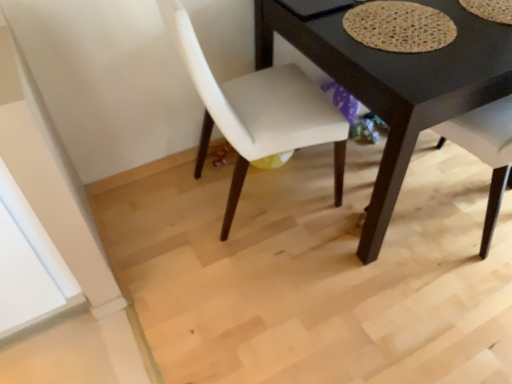
Question: Is white fabric chair at center shorter than textured beige mat at upper right?

Choices:
 (A) no
 (B) yes

Answer: (A)

Question: Considering the relative sizes of white fabric chair at center and textured beige mat at upper right in the image provided, is white fabric chair at center taller than textured beige mat at upper right?

Choices:
 (A) yes
 (B) no

Answer: (A)

Question: Can you confirm if white fabric chair at center is positioned to the left of textured beige mat at upper right?

Choices:
 (A) no
 (B) yes

Answer: (B)

Question: Is white fabric chair at center positioned in front of textured beige mat at upper right?

Choices:
 (A) yes
 (B) no

Answer: (A)

Question: Does white fabric chair at center have a lesser width compared to textured beige mat at upper right?

Choices:
 (A) yes
 (B) no

Answer: (B)

Question: Is point (419, 24) closer or farther from the camera than point (399, 97)?

Choices:
 (A) closer
 (B) farther

Answer: (B)

Question: Visually, is textured beige mat at upper right positioned to the left or to the right of black matte table at center?

Choices:
 (A) right
 (B) left

Answer: (B)

Question: In terms of width, does textured beige mat at upper right look wider or thinner when compared to black matte table at center?

Choices:
 (A) wide
 (B) thin

Answer: (B)

Question: From the image's perspective, relative to black matte table at center, is textured beige mat at upper right above or below?

Choices:
 (A) above
 (B) below

Answer: (A)

Question: Based on their positions, is textured beige mat at upper right located to the left or right of white fabric chair at center?

Choices:
 (A) left
 (B) right

Answer: (B)

Question: From a real-world perspective, is textured beige mat at upper right physically located above or below white fabric chair at center?

Choices:
 (A) above
 (B) below

Answer: (A)

Question: Is textured beige mat at upper right bigger or smaller than white fabric chair at center?

Choices:
 (A) small
 (B) big

Answer: (A)

Question: Considering the positions of textured beige mat at upper right and white fabric chair at center in the image, is textured beige mat at upper right wider or thinner than white fabric chair at center?

Choices:
 (A) thin
 (B) wide

Answer: (A)

Question: From the image's perspective, is white fabric chair at center above or below textured beige mat at upper right?

Choices:
 (A) below
 (B) above

Answer: (A)

Question: Looking at their shapes, would you say white fabric chair at center is wider or thinner than textured beige mat at upper right?

Choices:
 (A) thin
 (B) wide

Answer: (B)